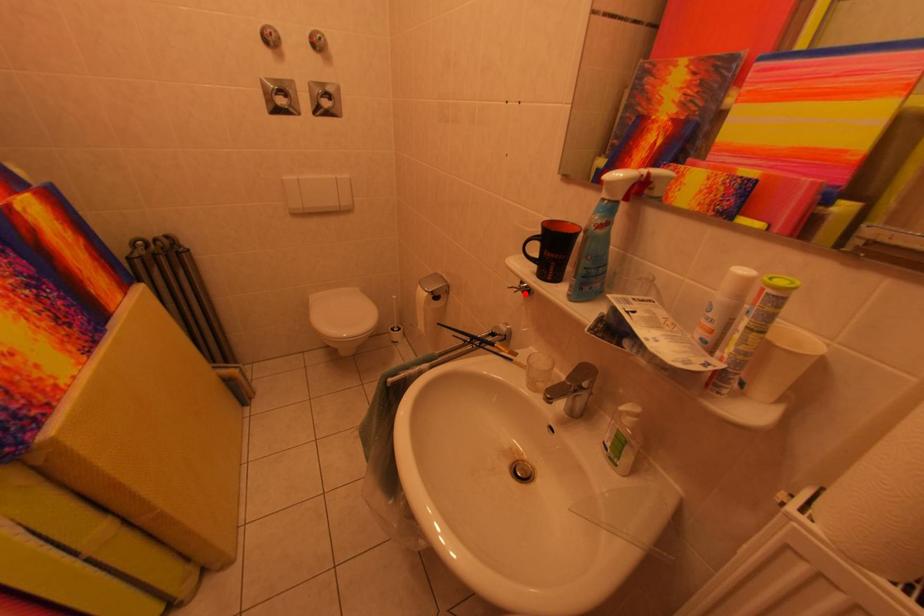
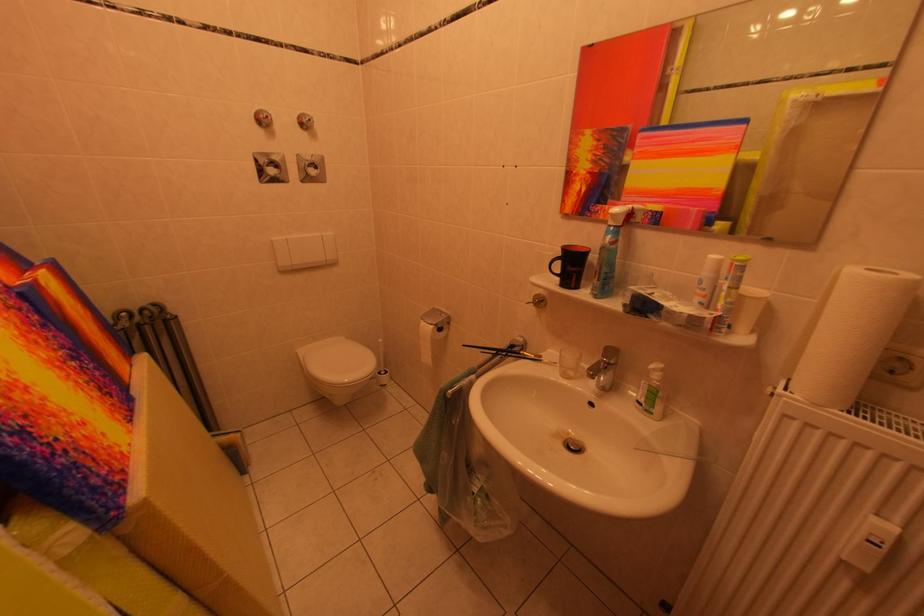
In the second image, find the point that corresponds to the highlighted location in the first image.

(541, 308)